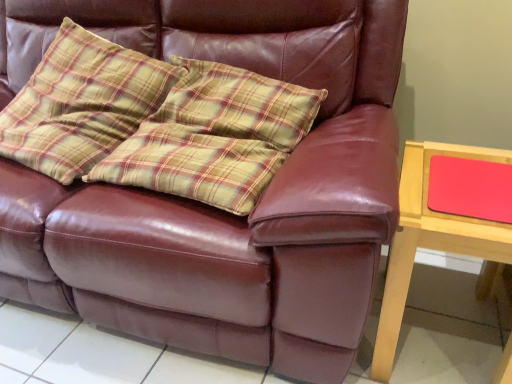
Locate an element on the screen. This screenshot has width=512, height=384. free point above wooden table at right (from a real-world perspective) is located at coordinates (466, 179).